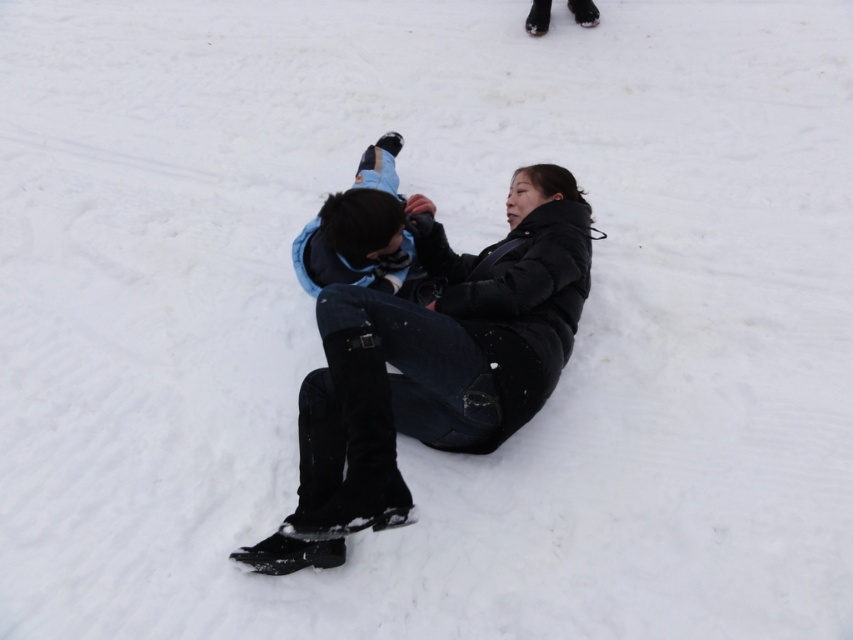
You are planning to take a winter photo with two people. You have a black matte jacket at center and a light blue denim snowboard at center in the frame. Which object is wider?

The black matte jacket at center is wider than the light blue denim snowboard at center.

You are standing in the snowy area and want to reach both points, point (582, 280) and point (355, 234). Which point is closer to you?

Point (355, 234) is closer to you because it is less further to the viewer than point (582, 280).